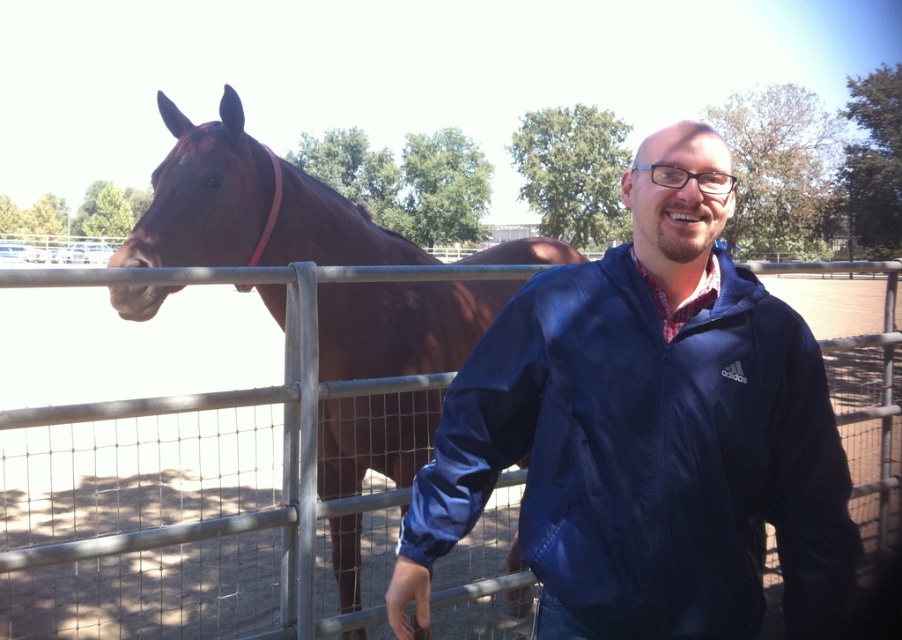
In the scene shown: Which is above, navy blue windbreaker at right or brown glossy horse at left?

Positioned higher is navy blue windbreaker at right.

Can you confirm if navy blue windbreaker at right is wider than brown glossy horse at left?

No, navy blue windbreaker at right is not wider than brown glossy horse at left.

Does point (569, 444) lie in front of point (295, 243)?

Yes, it is.

In order to click on navy blue windbreaker at right in this screenshot , I will do `click(649, 456)`.